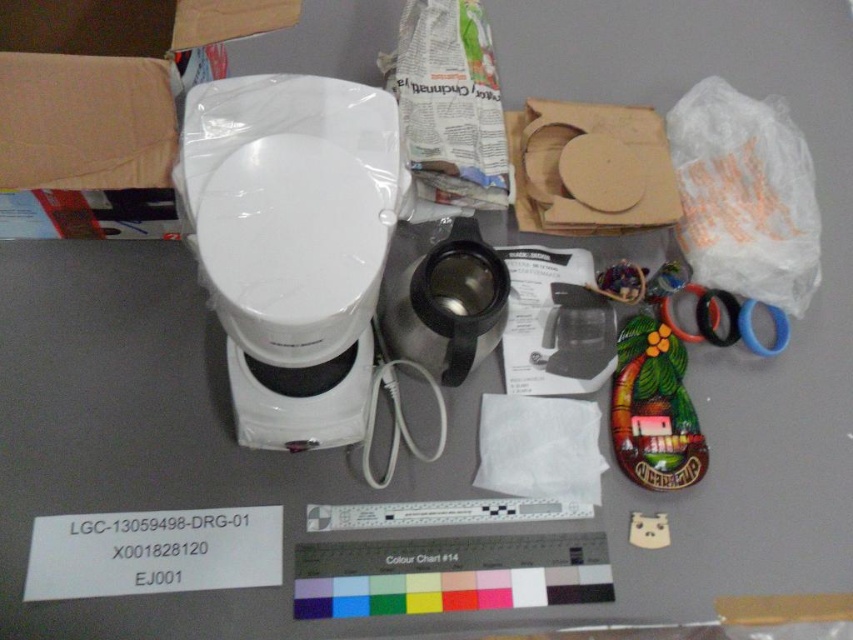
Question: Is white glossy toilet bowl at center positioned at the back of matte green ceramic toy at lower right?

Choices:
 (A) no
 (B) yes

Answer: (A)

Question: Can you confirm if white glossy toilet bowl at center is smaller than white matte toilet paper at center?

Choices:
 (A) no
 (B) yes

Answer: (A)

Question: Among these objects, which one is farthest from the camera?

Choices:
 (A) matte green ceramic toy at lower right
 (B) blue rubber band at right
 (C) cardboard box at center
 (D) white glossy toilet bowl at center

Answer: (B)

Question: Which of the following is the farthest from the observer?

Choices:
 (A) matte green ceramic toy at lower right
 (B) cardboard box at center
 (C) blue rubber band at right

Answer: (C)

Question: Estimate the real-world distances between objects in this image. Which object is farther from the white matte toilet paper at center?

Choices:
 (A) matte green ceramic toy at lower right
 (B) white glossy toilet bowl at center

Answer: (B)

Question: In this image, where is white glossy toilet bowl at center located relative to blue rubber band at right?

Choices:
 (A) left
 (B) right

Answer: (A)